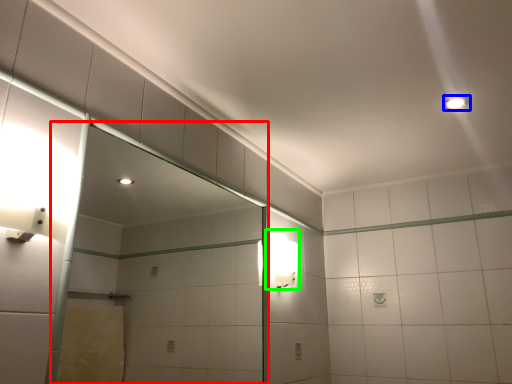
Question: Which object is positioned farthest from glass door (highlighted by a red box)? Select from light fixture (highlighted by a blue box) and light fixture (highlighted by a green box).

Choices:
 (A) light fixture
 (B) light fixture

Answer: (A)